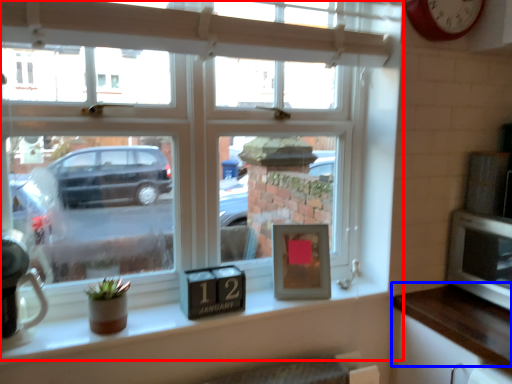
Question: Among these objects, which one is farthest to the camera, window (highlighted by a red box) or counter top (highlighted by a blue box)?

Choices:
 (A) window
 (B) counter top

Answer: (B)